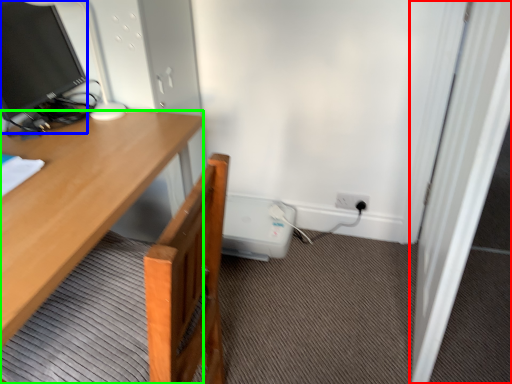
Question: Which is nearer to the screen door (highlighted by a red box)? television (highlighted by a blue box) or desk (highlighted by a green box).

Choices:
 (A) television
 (B) desk

Answer: (B)